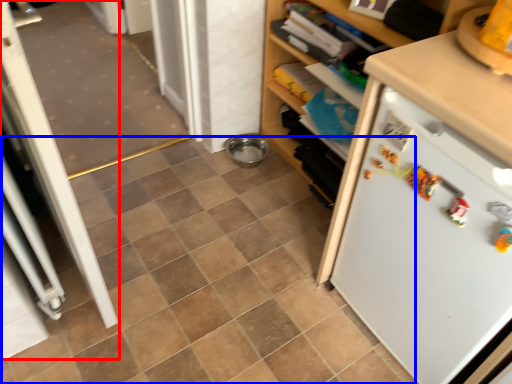
Question: Among these objects, which one is farthest to the camera, screen door (highlighted by a red box) or ceramic tile (highlighted by a blue box)?

Choices:
 (A) screen door
 (B) ceramic tile

Answer: (B)